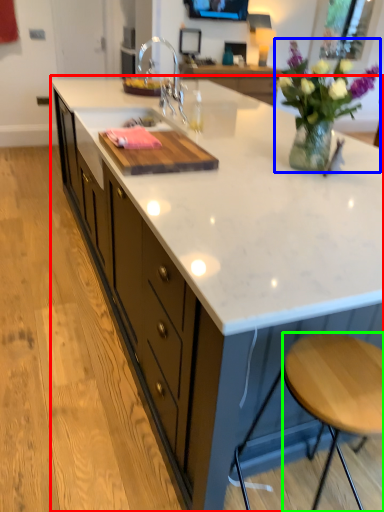
Question: Considering the real-world distances, which object is closest to countertop (highlighted by a red box)? floral arrangement (highlighted by a blue box) or stool (highlighted by a green box).

Choices:
 (A) floral arrangement
 (B) stool

Answer: (A)